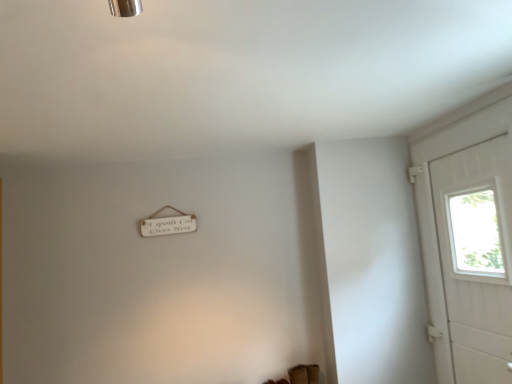
Question: Should I look upward or downward to see white wooden door at right?

Choices:
 (A) up
 (B) down

Answer: (B)